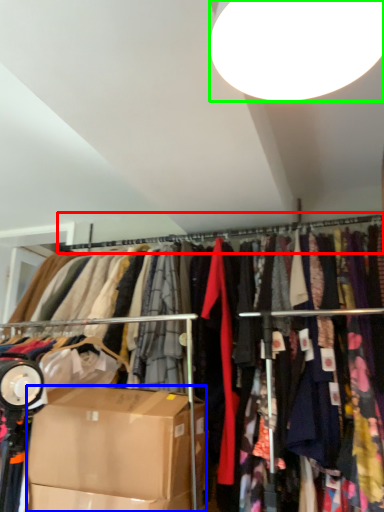
Question: Which object is the closest to the clothesline (highlighted by a red box)? Choose among these: box (highlighted by a blue box) or lamp (highlighted by a green box).

Choices:
 (A) box
 (B) lamp

Answer: (A)